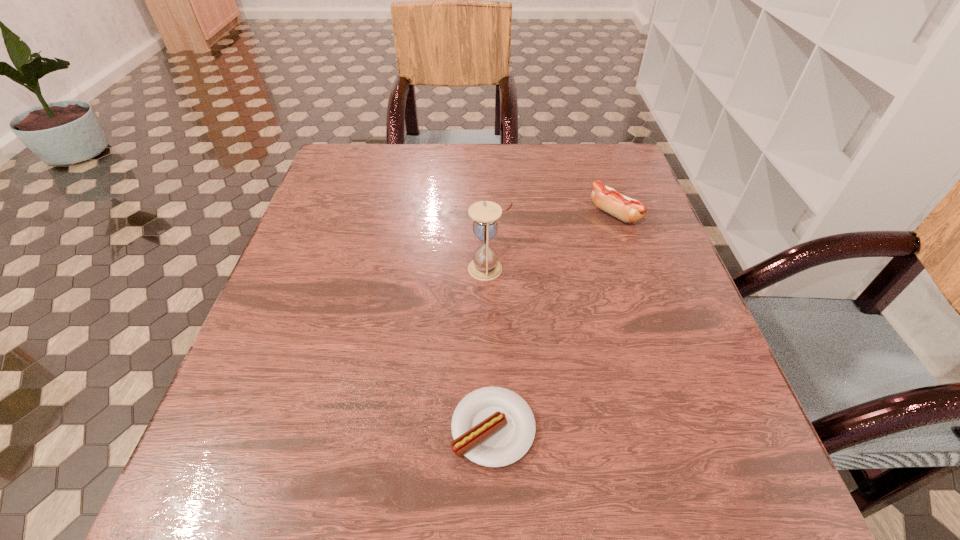
I want to click on object located in the right edge section of the desktop, so click(628, 210).

The height and width of the screenshot is (540, 960). Find the location of `free location at the far edge of the desktop`. free location at the far edge of the desktop is located at coordinates (551, 155).

I want to click on free space at the near edge, so click(x=485, y=500).

This screenshot has width=960, height=540. I want to click on vacant space at the left edge, so click(x=303, y=309).

I want to click on vacant space at the right edge, so click(704, 407).

The height and width of the screenshot is (540, 960). In the image, there is a desktop. What are the coordinates of `vacant space at the far left corner` in the screenshot? It's located at (343, 158).

You are a GUI agent. You are given a task and a screenshot of the screen. Output one action in this format:
    pyautogui.click(x=<x>, y=<y>)
    Task: Click on the vacant space at the far right corner of the desktop
    The height and width of the screenshot is (540, 960).
    Given the screenshot: What is the action you would take?
    pyautogui.click(x=589, y=145)

This screenshot has width=960, height=540. I want to click on free space at the near right corner of the desktop, so click(x=780, y=505).

Locate an element on the screen. This screenshot has height=540, width=960. vacant space in between the second farthest object and the nearer sausage is located at coordinates (491, 348).

Identify the location of free spot between the tallest object and the left sausage. (491, 348).